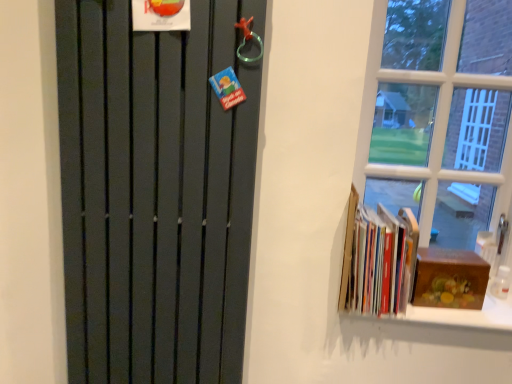
Question: From their relative heights in the image, would you say hardcover books at right is taller or shorter than matte black radiator at left?

Choices:
 (A) tall
 (B) short

Answer: (B)

Question: Does point (388, 253) appear closer or farther from the camera than point (120, 9)?

Choices:
 (A) farther
 (B) closer

Answer: (A)

Question: Based on their relative distances, which object is nearer to the wooden box at right?

Choices:
 (A) matte black radiator at left
 (B) hardcover books at right

Answer: (B)

Question: Which is nearer to the hardcover books at right?

Choices:
 (A) wooden box at right
 (B) matte black radiator at left

Answer: (A)